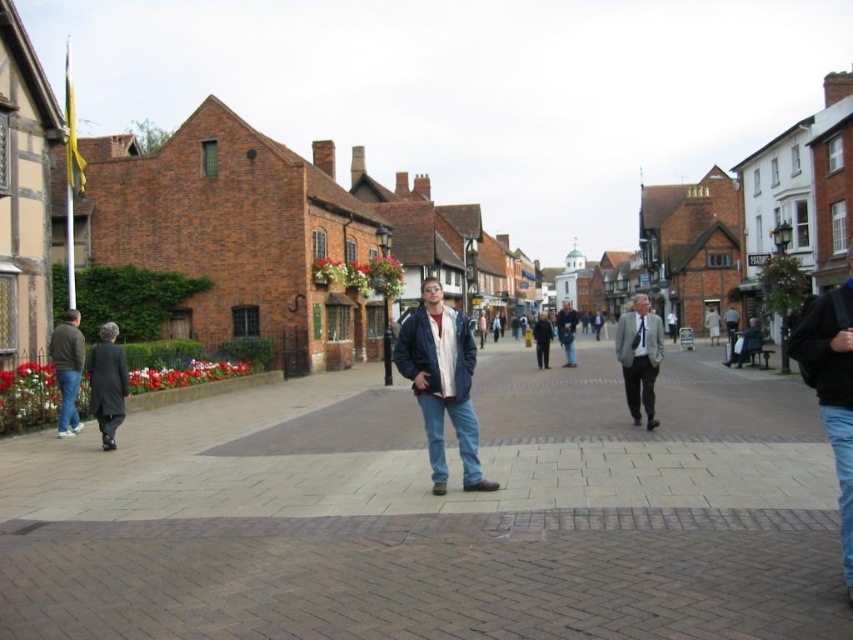
Is brown brick pavement at center bigger than denim jacket at center?

Yes.

Can you confirm if brown brick pavement at center is shorter than denim jacket at center?

Correct, brown brick pavement at center is not as tall as denim jacket at center.

Is point (740, 624) more distant than point (459, 378)?

No, (740, 624) is in front of (459, 378).

Where is `brown brick pavement at center`? brown brick pavement at center is located at coordinates (434, 516).

Who is more forward, [793,340] or [115,445]?

Point [793,340] is more forward.

Can you confirm if black leather jacket at lower right is positioned below dark gray wool coat at left?

No.

The width and height of the screenshot is (853, 640). What do you see at coordinates (833, 388) in the screenshot? I see `black leather jacket at lower right` at bounding box center [833, 388].

At what (x,y) coordinates should I click in order to perform the action: click on black leather jacket at lower right. Please return your answer as a coordinate pair (x, y). This screenshot has width=853, height=640. Looking at the image, I should click on (833, 388).

Is point (514, 428) closer to camera compared to point (572, 349)?

Yes, point (514, 428) is closer to viewer.

Locate an element on the screen. Image resolution: width=853 pixels, height=640 pixels. brown brick pavement at center is located at coordinates (434, 516).